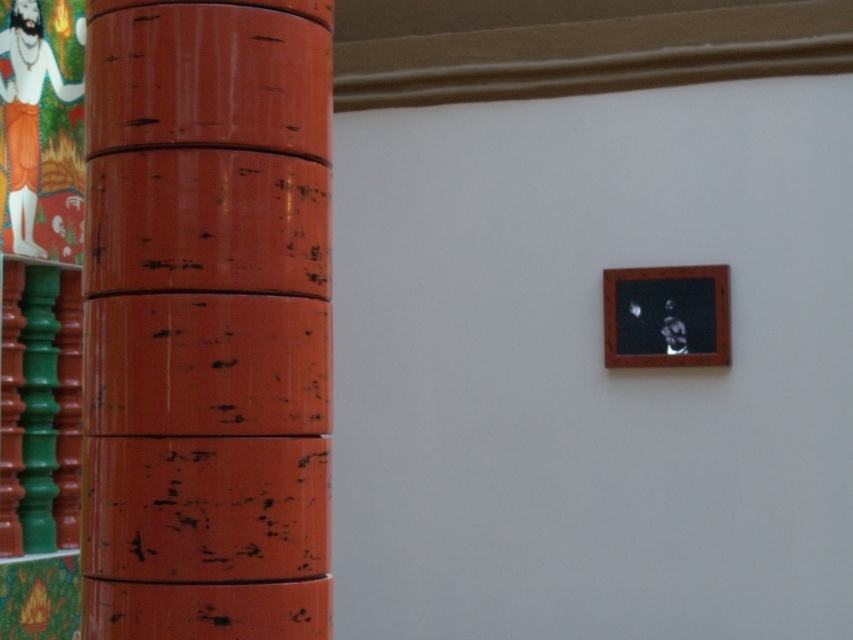
Question: Which point appears farthest from the camera in this image?

Choices:
 (A) (308, 460)
 (B) (706, 349)

Answer: (B)

Question: Among these points, which one is nearest to the camera?

Choices:
 (A) (701, 358)
 (B) (149, 230)

Answer: (B)

Question: Which of the following is the farthest from the observer?

Choices:
 (A) (248, 326)
 (B) (662, 358)

Answer: (B)

Question: In this image, where is scratched orange pillar at left located relative to wooden frame at upper right?

Choices:
 (A) right
 (B) left

Answer: (B)

Question: Can you confirm if scratched orange pillar at left is wider than wooden frame at upper right?

Choices:
 (A) yes
 (B) no

Answer: (A)

Question: Is scratched orange pillar at left to the right of wooden frame at upper right from the viewer's perspective?

Choices:
 (A) yes
 (B) no

Answer: (B)